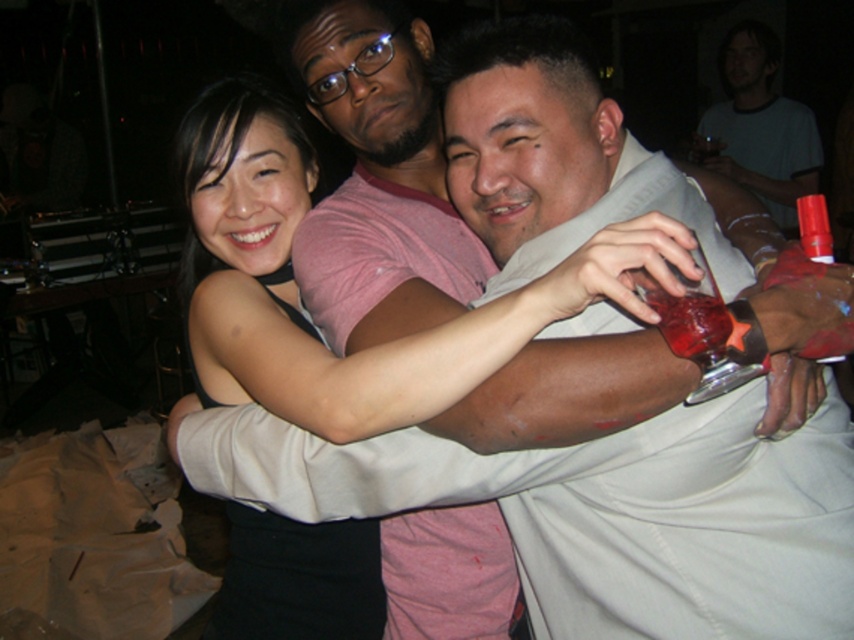
Is light beige shirt at center taller than translucent glass at right?

Yes.

Does light beige shirt at center lie behind translucent glass at right?

Yes.

Describe the element at coordinates (688, 525) in the screenshot. Image resolution: width=854 pixels, height=640 pixels. I see `light beige shirt at center` at that location.

Image resolution: width=854 pixels, height=640 pixels. What are the coordinates of `light beige shirt at center` in the screenshot? It's located at click(688, 525).

Describe the element at coordinates (390, 342) in the screenshot. Image resolution: width=854 pixels, height=640 pixels. I see `black matte dress at center` at that location.

Consider the image. Can you confirm if black matte dress at center is shorter than matte white shirt at upper right?

Indeed, black matte dress at center has a lesser height compared to matte white shirt at upper right.

Is point (285, 157) positioned behind point (740, 22)?

No, it is not.

Image resolution: width=854 pixels, height=640 pixels. Find the location of `black matte dress at center`. black matte dress at center is located at coordinates (390, 342).

Is matte white shirt at upper right below translucent glass at right?

No, matte white shirt at upper right is not below translucent glass at right.

Who is more distant from viewer, (794, 140) or (679, 320)?

Point (794, 140)

Where is `matte white shirt at upper right`? matte white shirt at upper right is located at coordinates (759, 125).